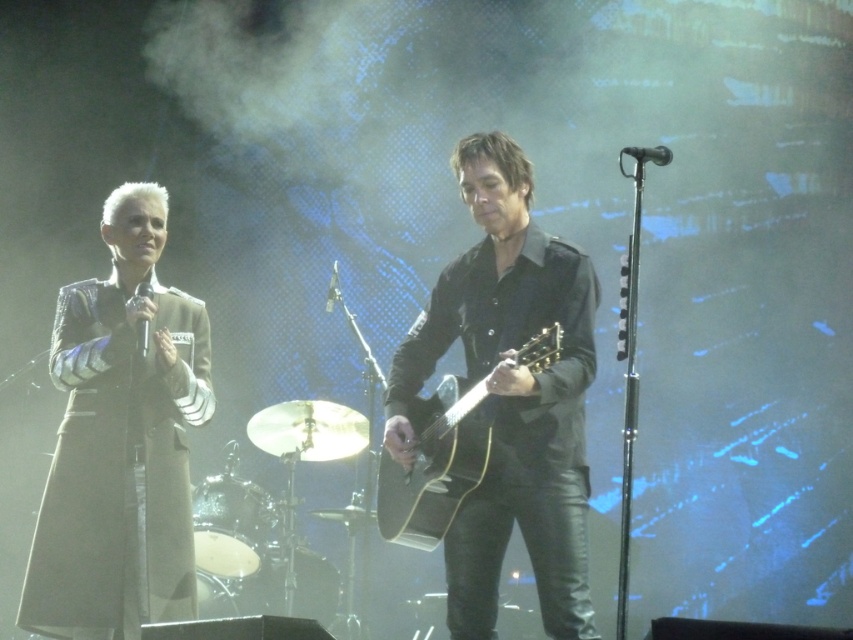
You are a stagehand setting up the stage for a performance. You need to place a new spotlight that can cover both the black leather guitar at center and the smooth silver drum at lower left. Based on their positions, which object is closer to the left side of the stage?

The smooth silver drum at lower left is closer to the left side of the stage because it is positioned to the left of the black leather guitar at center.

You are standing in the audience and see a point marked at coordinates (96, 296) in the image. If you want to throw a flower bouquet to that point, and the average throwing distance is 3 meters, will you be able to reach it?

The point at coordinates (96, 296) is 3.39 meters away from the camera. Since the average throwing distance is 3 meters, you will not be able to reach it as the distance is greater than your throwing range.

You are a stagehand adjusting the lighting for the performance. You need to ensure that the leather jacket at left and the black glossy microphone at left are both visible under the spotlight. Given their sizes, which object might require a larger spotlight to fully illuminate?

The leather jacket at left has a greater height compared to the black glossy microphone at left, so it would require a larger spotlight to fully illuminate.